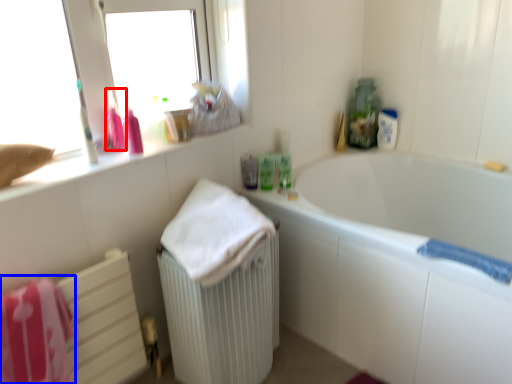
Question: Which of the following is the closest to the observer, cleaning product (highlighted by a red box) or bath towel (highlighted by a blue box)?

Choices:
 (A) cleaning product
 (B) bath towel

Answer: (B)